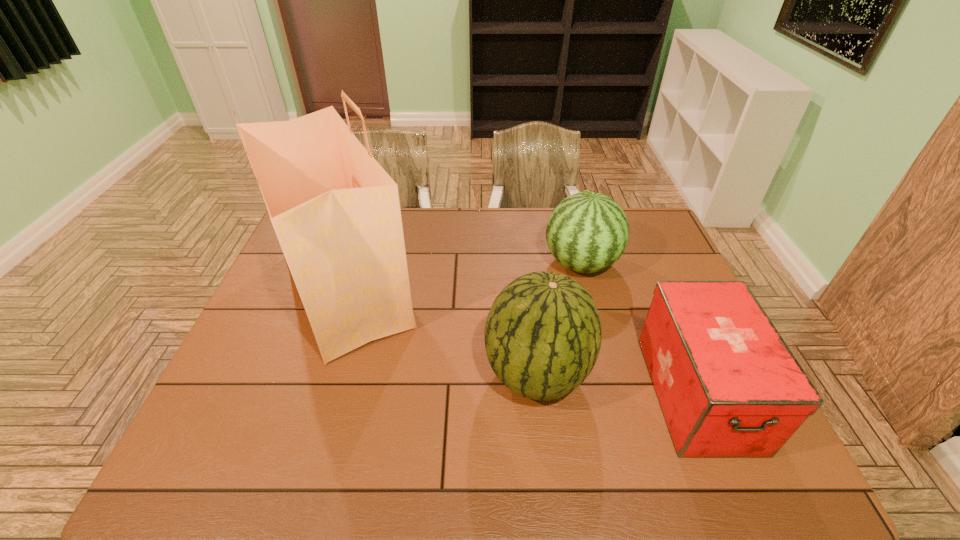
The height and width of the screenshot is (540, 960). Identify the location of grocery bag. (336, 212).

The image size is (960, 540). I want to click on the tallest object, so click(336, 212).

The height and width of the screenshot is (540, 960). Identify the location of the nearer watermelon. (543, 334).

At what (x,y) coordinates should I click in order to perform the action: click on the farther watermelon. Please return your answer as a coordinate pair (x, y). The height and width of the screenshot is (540, 960). Looking at the image, I should click on (587, 232).

This screenshot has width=960, height=540. Find the location of `the shortest object`. the shortest object is located at coordinates (728, 385).

Locate an element on the screen. Image resolution: width=960 pixels, height=540 pixels. free spot located on the side of the tallest object with the superhero design is located at coordinates (471, 291).

At what (x,y) coordinates should I click in order to perform the action: click on vacant space situated on the back of the nearer watermelon. Please return your answer as a coordinate pair (x, y). Image resolution: width=960 pixels, height=540 pixels. Looking at the image, I should click on (525, 279).

Find the location of `free spot located on the front of the farther watermelon`. free spot located on the front of the farther watermelon is located at coordinates (594, 314).

You are a GUI agent. You are given a task and a screenshot of the screen. Output one action in this format:
    pyautogui.click(x=<x>, y=<y>)
    Task: Click on the grocery bag at the far edge
    
    Given the screenshot: What is the action you would take?
    pyautogui.click(x=336, y=212)

Identify the location of watermelon that is at the far edge. (587, 232).